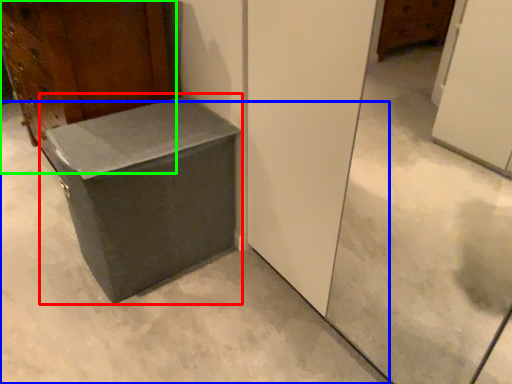
Question: Which object is positioned closest to cardboard box (highlighted by a red box)? Select from concrete (highlighted by a blue box) and furniture (highlighted by a green box).

Choices:
 (A) concrete
 (B) furniture

Answer: (A)